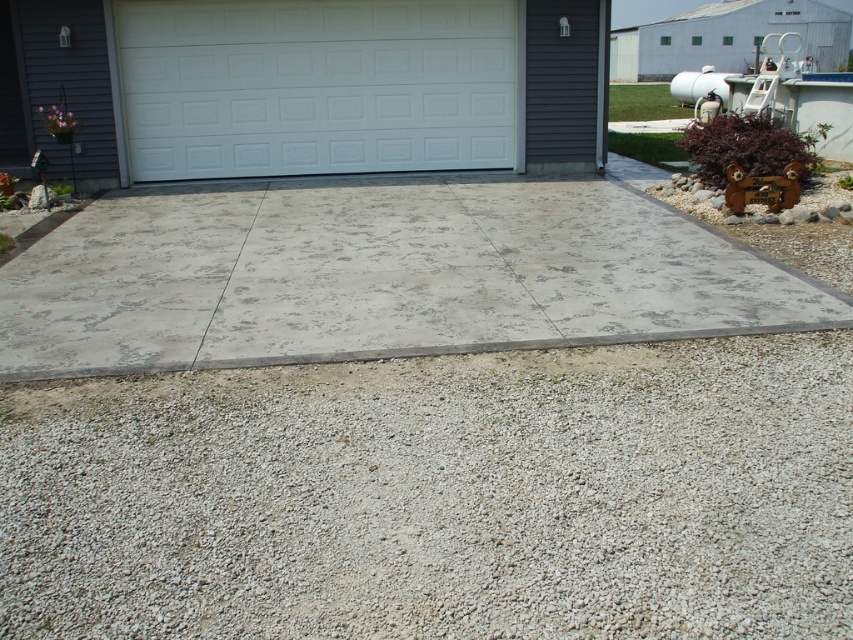
Question: Does gray gravel at lower center appear on the right side of white painted wood garage door at center?

Choices:
 (A) yes
 (B) no

Answer: (A)

Question: Which point appears closest to the camera in this image?

Choices:
 (A) (302, 128)
 (B) (479, 316)

Answer: (B)

Question: Which object is the closest to the gray concrete pavement at center?

Choices:
 (A) white painted wood garage door at center
 (B) gray gravel at lower center

Answer: (B)

Question: Is gray concrete pavement at center behind white painted wood garage door at center?

Choices:
 (A) yes
 (B) no

Answer: (B)

Question: Is gray concrete pavement at center wider than white painted wood garage door at center?

Choices:
 (A) no
 (B) yes

Answer: (B)

Question: Which object appears closest to the camera in this image?

Choices:
 (A) white painted wood garage door at center
 (B) gray gravel at lower center
 (C) gray concrete pavement at center

Answer: (B)